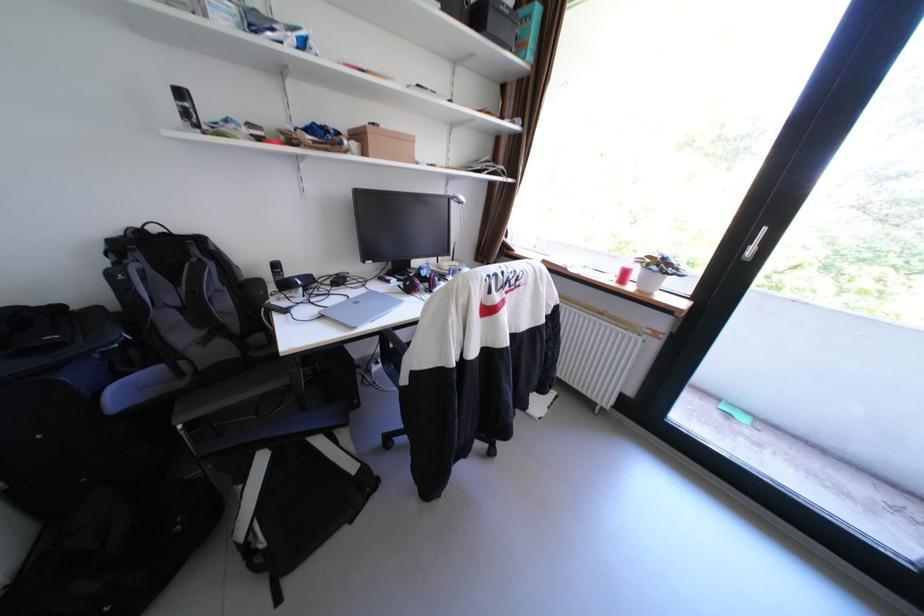
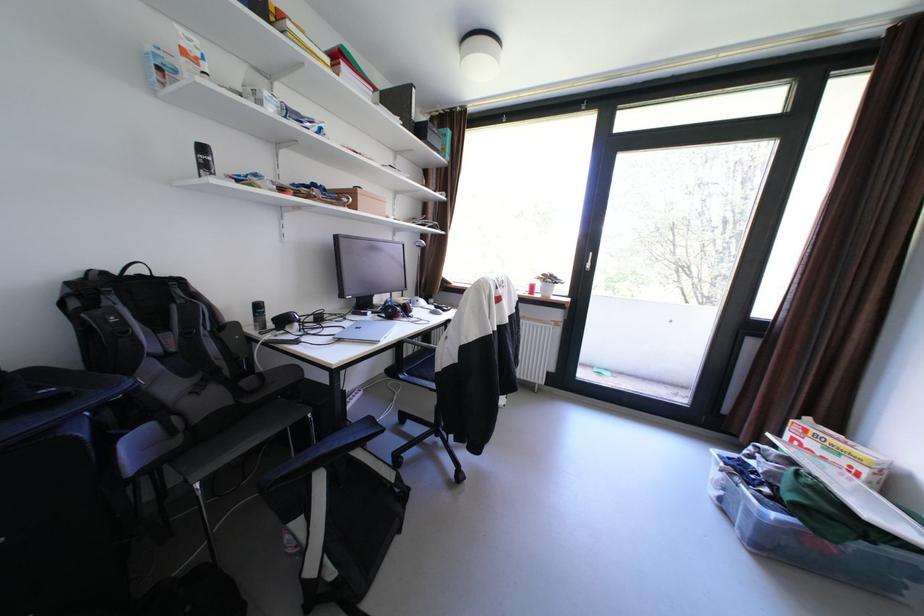
The point at (405,281) is marked in the first image. Where is the corresponding point in the second image?

(380, 313)